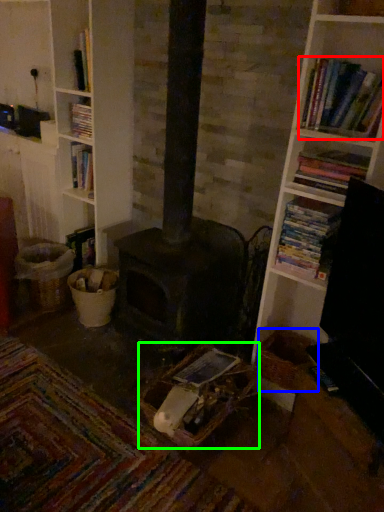
Question: Which object is positioned closest to book (highlighted by a red box)? Select from basket (highlighted by a blue box) and basket (highlighted by a green box).

Choices:
 (A) basket
 (B) basket

Answer: (A)